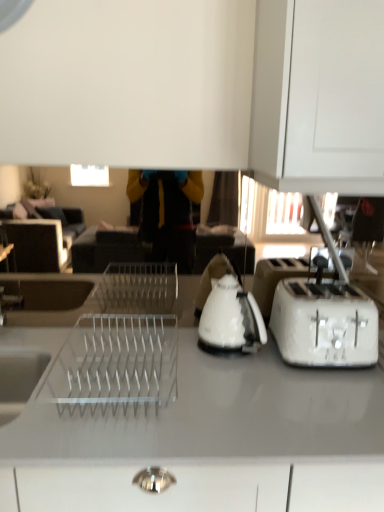
Where is `vacant space positioned to the left of white glossy kettle at center`? vacant space positioned to the left of white glossy kettle at center is located at coordinates (180, 343).